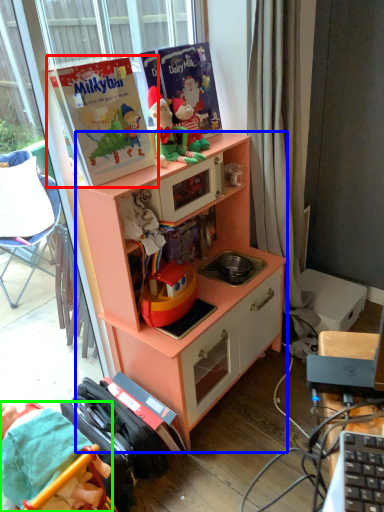
Question: Which object is the closest to the paperback book (highlighted by a red box)? Choose among these: cabinetry (highlighted by a blue box) or person (highlighted by a green box).

Choices:
 (A) cabinetry
 (B) person

Answer: (A)